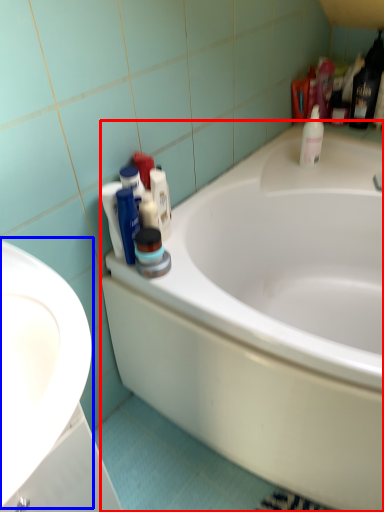
Question: Which object is closer to the camera taking this photo, bathtub (highlighted by a red box) or sink (highlighted by a blue box)?

Choices:
 (A) bathtub
 (B) sink

Answer: (B)